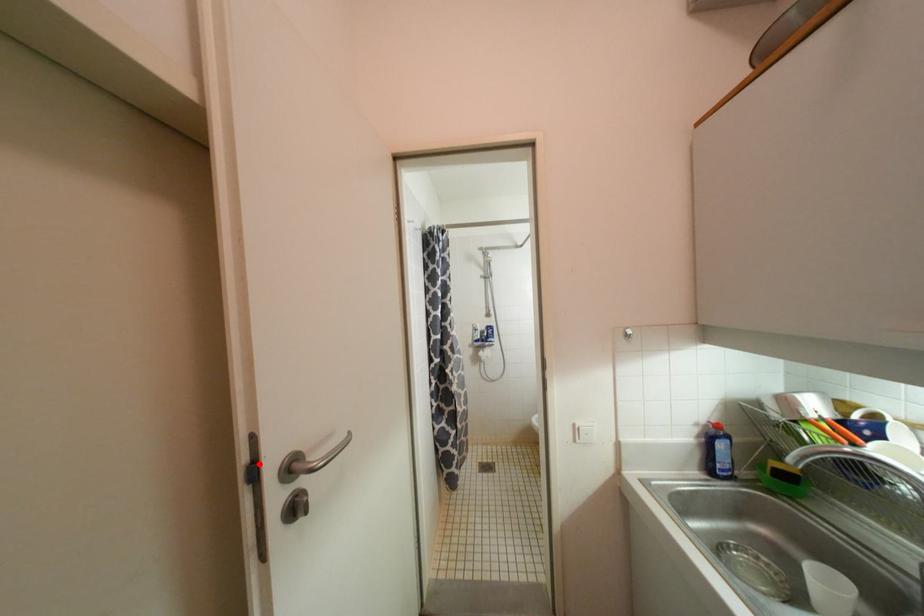
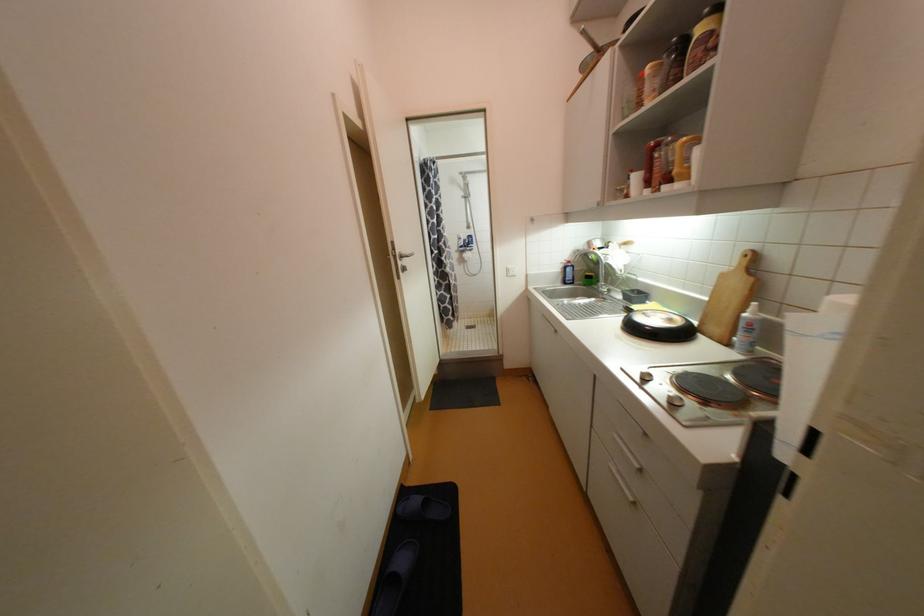
Question: A red point is marked in image1. In image2, is the corresponding 3D point closer to the camera or farther? Reply with the corresponding letter.

Choices:
 (A) The corresponding 3D point is closer.
 (B) The corresponding 3D point is farther.

Answer: (A)